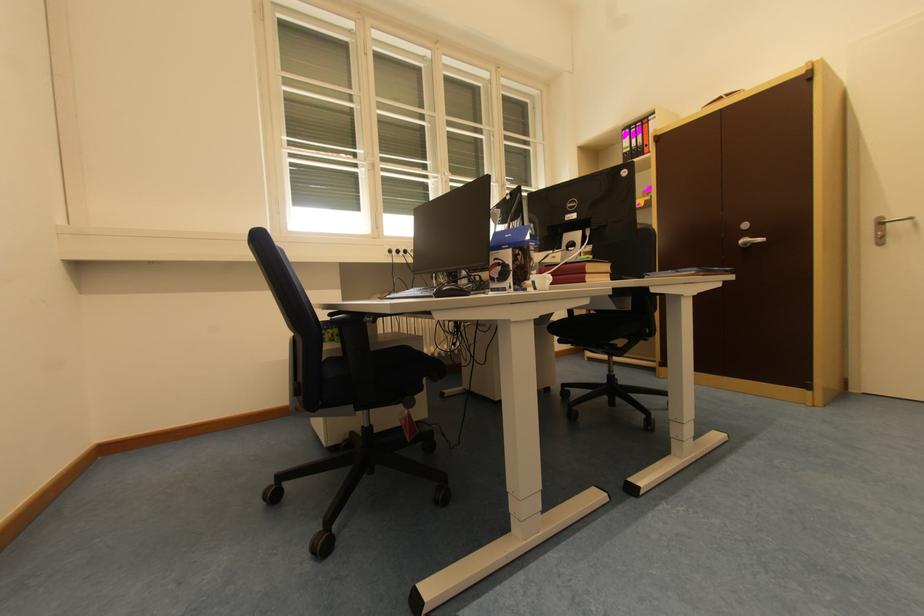
Where would you pull the silver cabinet handle? Please return your answer as a coordinate pair (x, y).

(749, 241)